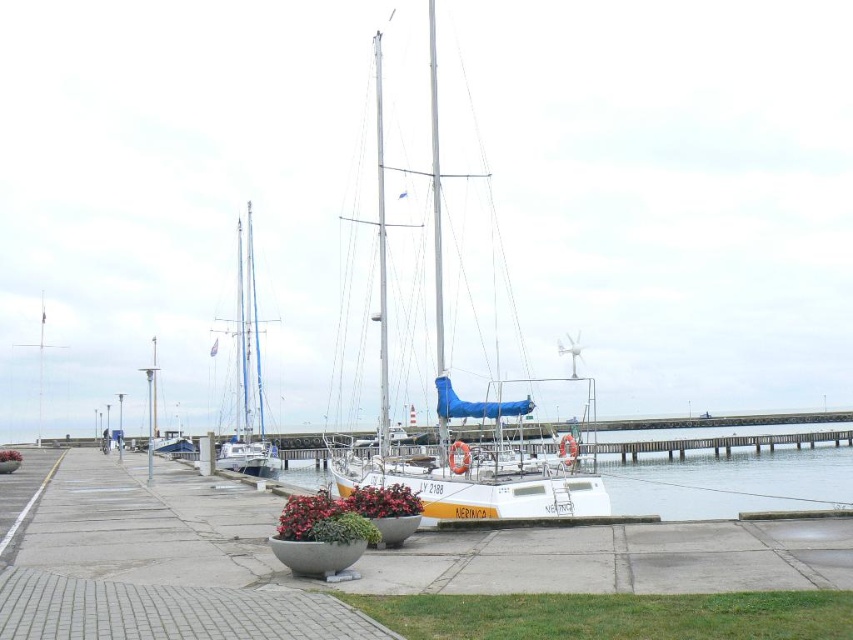
You are a boat inspector standing at the edge of the walkway near the two large, round concrete planters filled with vibrant red flowers. You need to locate the white sailboat at center for inspection. According to the coordinates provided, where exactly should you look to find it?

The white sailboat at center is located at coordinates point [460,403], so you should look towards the midground area slightly to the right of the center point of the image to find it.

You are a dock worker who needs to move a 50 feet long cargo container between the white sailboat at center and the white glossy sailboat at left. Can you fit the cargo container between them without overlapping either boat?

The distance between the white sailboat at center and the white glossy sailboat at left is 53.27 feet. Since the cargo container is 50 feet long, it can fit between them as there is enough space.